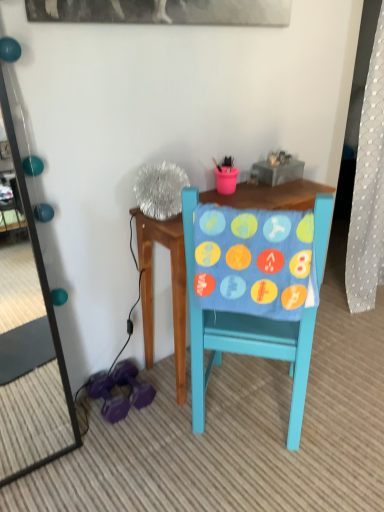
Where is `vacant space to the left of matte blue chair at center`? vacant space to the left of matte blue chair at center is located at coordinates (135, 441).